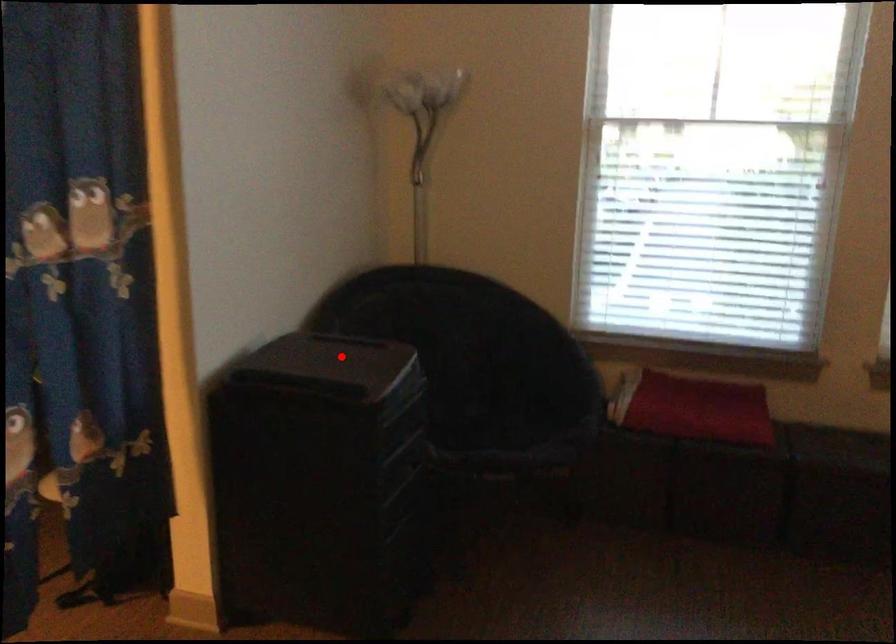
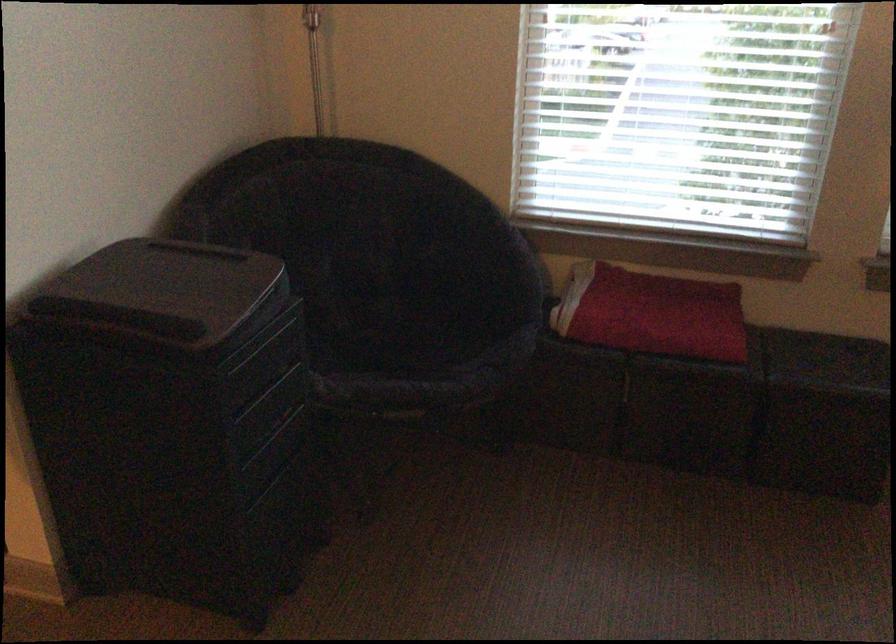
In the second image, find the point that corresponds to the highlighted location in the first image.

(188, 281)